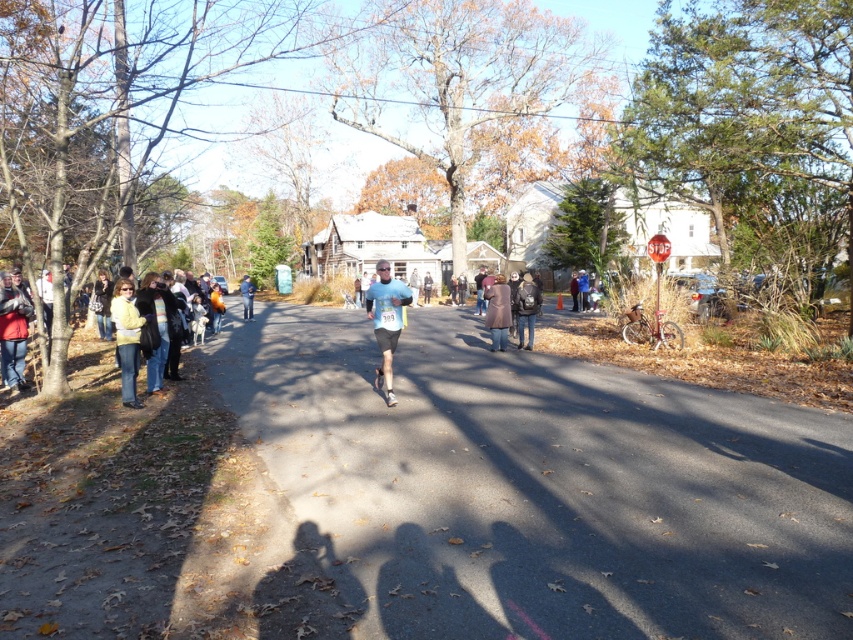
You are a participant in the race and see two points marked on the road ahead. The first point is at coordinates point (x=389, y=333) and the second point is at point (x=502, y=301). Which point is closer to you as you run towards the camera?

Point (x=389, y=333) is in front of point (x=502, y=301), so it is closer to you as you run towards the camera.

You are a photographer at the event and want to capture both the light blue fabric shirt at center and the brown wool coat at center in a single frame. Your camera has a maximum focus range of 5 meters. Can you fit both subjects within the frame without moving?

The light blue fabric shirt at center is 5.65 meters from the brown wool coat at center. Since the distance between them exceeds the camera maximum focus range of 5 meters, you cannot fit both subjects within the frame without moving.